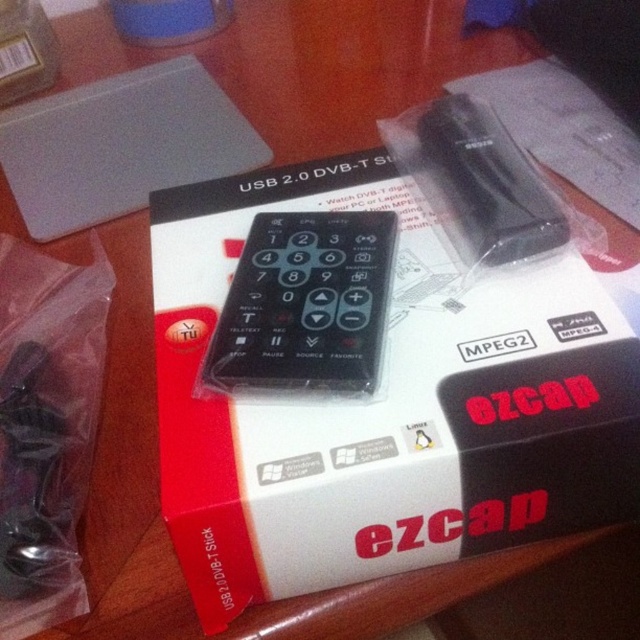
Who is lower down, black plastic box at center or black matte remote at center?

black plastic box at center

Identify the location of black plastic box at center. Image resolution: width=640 pixels, height=640 pixels. (385, 404).

Which is behind, point (387, 269) or point (512, 193)?

Positioned behind is point (512, 193).

Consider the image. Can you confirm if black matte remote at center is positioned to the right of black plastic remote at upper center?

Incorrect, black matte remote at center is not on the right side of black plastic remote at upper center.

What do you see at coordinates (305, 307) in the screenshot? The width and height of the screenshot is (640, 640). I see `black matte remote at center` at bounding box center [305, 307].

Identify the location of black matte remote at center. This screenshot has height=640, width=640. (305, 307).

Who is shorter, black plastic box at center or black plastic remote at upper center?

black plastic remote at upper center is shorter.

Which of these two, black plastic box at center or black plastic remote at upper center, stands taller?

black plastic box at center is taller.

Looking at this image, who is more forward, (483, 310) or (432, 184)?

Positioned in front is point (483, 310).

Find the location of a particular element. black plastic box at center is located at coordinates (385, 404).